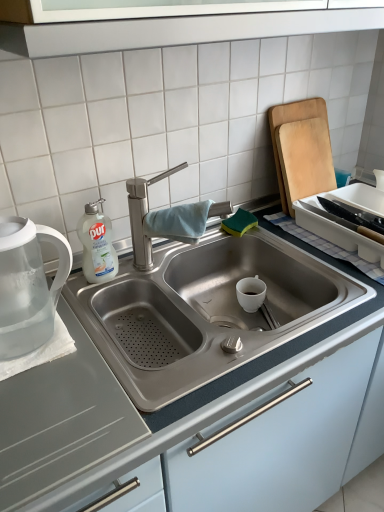
Question: Based on their sizes in the image, would you say white liquid soap at left is bigger or smaller than wooden cutting board at right?

Choices:
 (A) small
 (B) big

Answer: (A)

Question: Considering the positions of white liquid soap at left and wooden cutting board at right in the image, is white liquid soap at left taller or shorter than wooden cutting board at right?

Choices:
 (A) short
 (B) tall

Answer: (A)

Question: Considering the real-world distances, which object is closest to the wooden cutting board at right?

Choices:
 (A) white liquid soap at left
 (B) brushed metal tap at center
 (C) satin steel sink at center
 (D) white plastic tray at upper right
 (E) transparent plastic tea pot at left

Answer: (D)

Question: Which object is positioned closest to the white plastic tray at upper right?

Choices:
 (A) transparent plastic tea pot at left
 (B) wooden cutting board at right
 (C) satin steel sink at center
 (D) white liquid soap at left
 (E) brushed metal tap at center

Answer: (B)